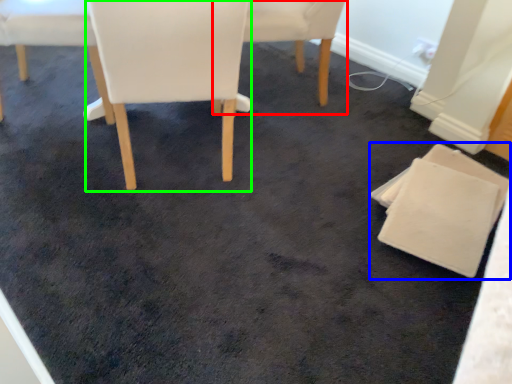
Question: Considering the real-world distances, which object is farthest from chair (highlighted by a red box)? chair (highlighted by a blue box) or chair (highlighted by a green box)?

Choices:
 (A) chair
 (B) chair

Answer: (A)